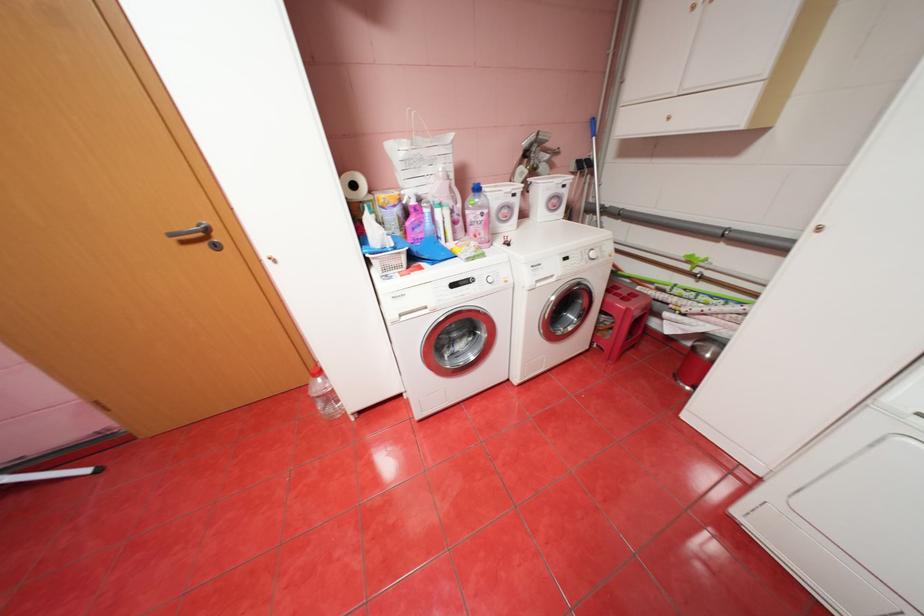
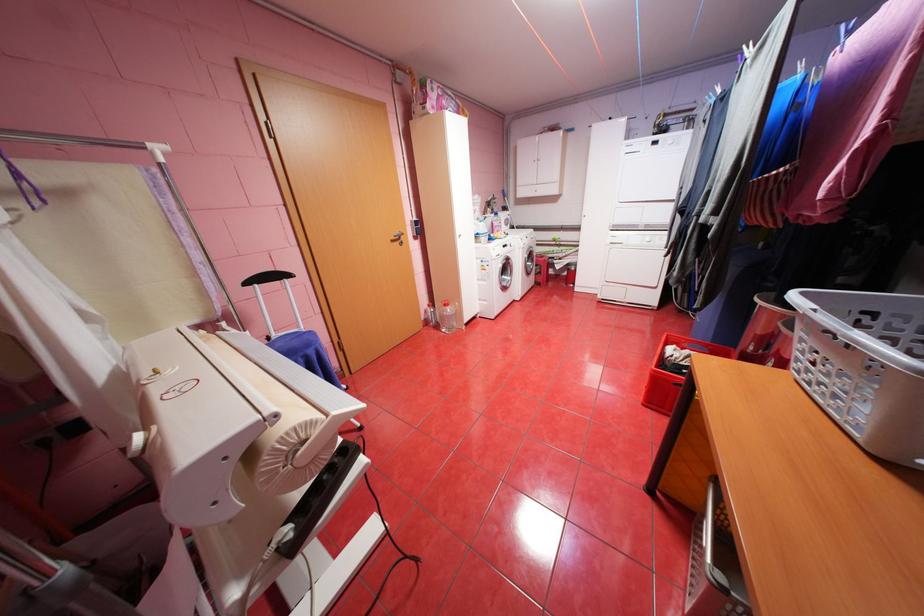
The point at (191,241) is marked in the first image. Where is the corresponding point in the second image?

(400, 241)